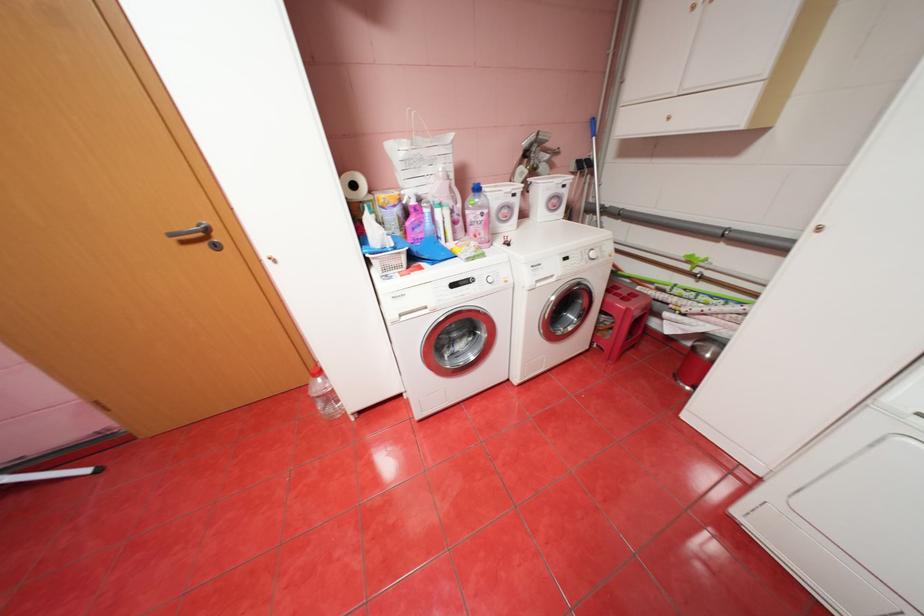
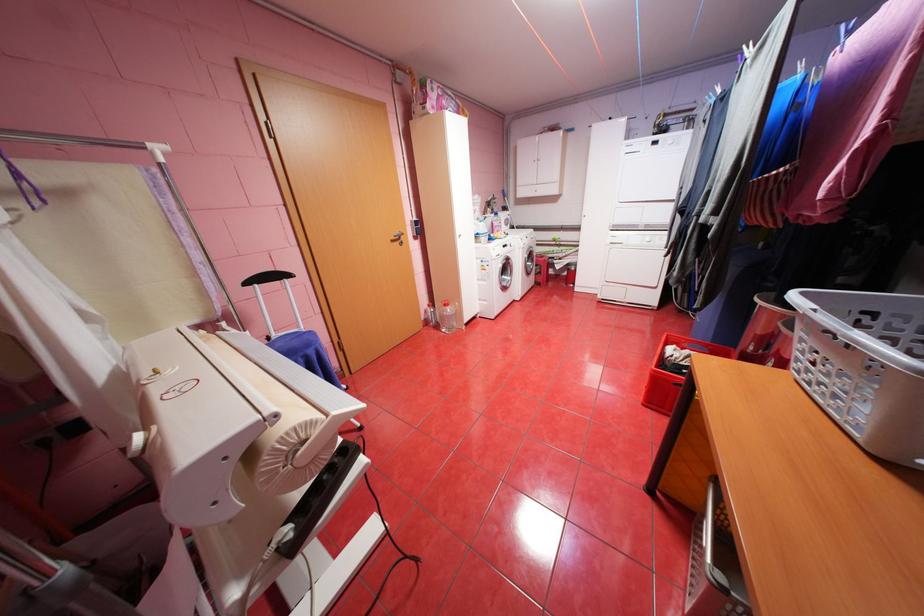
The point at (191,241) is marked in the first image. Where is the corresponding point in the second image?

(400, 241)